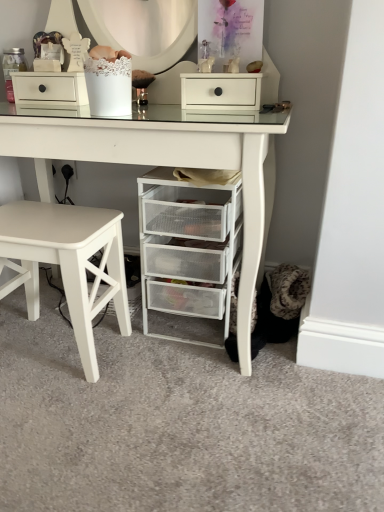
Question: Is point (24, 225) positioned closer to the camera than point (104, 151)?

Choices:
 (A) closer
 (B) farther

Answer: (B)

Question: Looking at the image, does white matte stool at lower left seem bigger or smaller compared to white mesh drawer unit at lower center?

Choices:
 (A) big
 (B) small

Answer: (B)

Question: Based on their relative distances, which object is nearer to the white matte stool at lower left?

Choices:
 (A) white mesh drawer unit at lower center
 (B) white matte drawer at upper center
 (C) white mesh drawer unit at lower right

Answer: (C)

Question: Which is farther from the white mesh drawer unit at lower center?

Choices:
 (A) white matte stool at lower left
 (B) white mesh drawer unit at lower right
 (C) white matte drawer at upper center

Answer: (A)